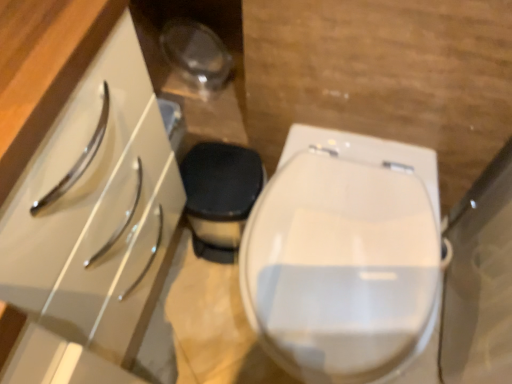
Identify the location of white glossy cabinet at left. (92, 226).

What do you see at coordinates (92, 226) in the screenshot? I see `white glossy cabinet at left` at bounding box center [92, 226].

The width and height of the screenshot is (512, 384). What do you see at coordinates (343, 256) in the screenshot? I see `white glossy toilet at center` at bounding box center [343, 256].

What is the approximate height of white glossy toilet at center?

white glossy toilet at center is 45.95 centimeters in height.

Locate an element on the screen. white glossy toilet at center is located at coordinates (343, 256).

At what (x,y) coordinates should I click in order to perform the action: click on white glossy cabinet at left. Please return your answer as a coordinate pair (x, y). The height and width of the screenshot is (384, 512). Looking at the image, I should click on (92, 226).

Does white glossy toilet at center appear on the right side of white glossy cabinet at left?

Yes, white glossy toilet at center is to the right of white glossy cabinet at left.

Is white glossy toilet at center in front of or behind white glossy cabinet at left in the image?

Visually, white glossy toilet at center is located behind white glossy cabinet at left.

Considering the positions of point (337, 155) and point (81, 286), is point (337, 155) closer or farther from the camera than point (81, 286)?

Point (337, 155) is positioned farther from the camera compared to point (81, 286).

From the picture: From the image's perspective, which one is positioned lower, white glossy toilet at center or white glossy cabinet at left?

white glossy toilet at center, from the image's perspective.

From a real-world perspective, is white glossy toilet at center over white glossy cabinet at left?

No, from a real-world perspective, white glossy toilet at center is not above white glossy cabinet at left.

Looking at this image, in terms of width, does white glossy toilet at center look wider or thinner when compared to white glossy cabinet at left?

In the image, white glossy toilet at center appears to be wider than white glossy cabinet at left.

Considering the relative sizes of white glossy toilet at center and white glossy cabinet at left in the image provided, is white glossy toilet at center taller than white glossy cabinet at left?

Incorrect, the height of white glossy toilet at center is not larger of that of white glossy cabinet at left.

Based on their sizes in the image, would you say white glossy toilet at center is bigger or smaller than white glossy cabinet at left?

Clearly, white glossy toilet at center is smaller in size than white glossy cabinet at left.

Is white glossy toilet at center inside the boundaries of white glossy cabinet at left, or outside?

white glossy toilet at center cannot be found inside white glossy cabinet at left.

Is white glossy toilet at center positioned far away from white glossy cabinet at left?

That's not correct — white glossy toilet at center is a little close to white glossy cabinet at left.

Is white glossy toilet at center turned away from white glossy cabinet at left?

No, white glossy toilet at center is not facing away from white glossy cabinet at left.

Locate an element on the screen. The image size is (512, 384). toilet that is below the white glossy cabinet at left (from the image's perspective) is located at coordinates (343, 256).

Between white glossy cabinet at left and white glossy toilet at center, which one appears on the left side from the viewer's perspective?

white glossy cabinet at left.

Which object is further away from the camera, white glossy cabinet at left or white glossy toilet at center?

white glossy toilet at center is further from the camera.

Which is in front, point (131, 293) or point (321, 359)?

The point (321, 359) is closer to the camera.

From the image's perspective, between white glossy cabinet at left and white glossy toilet at center, which one is located above?

white glossy cabinet at left is shown above in the image.

From a real-world perspective, is white glossy cabinet at left physically above white glossy toilet at center?

Yes, from a real-world perspective, white glossy cabinet at left is on top of white glossy toilet at center.

Considering the relative sizes of white glossy cabinet at left and white glossy toilet at center in the image provided, is white glossy cabinet at left wider than white glossy toilet at center?

No, white glossy cabinet at left is not wider than white glossy toilet at center.

Considering the relative sizes of white glossy cabinet at left and white glossy toilet at center in the image provided, is white glossy cabinet at left taller than white glossy toilet at center?

Yes, white glossy cabinet at left is taller than white glossy toilet at center.

In the scene shown: Is white glossy cabinet at left smaller than white glossy toilet at center?

No, white glossy cabinet at left is not smaller than white glossy toilet at center.

Can we say white glossy cabinet at left lies outside white glossy toilet at center?

Indeed, white glossy cabinet at left is completely outside white glossy toilet at center.

Does white glossy cabinet at left touch white glossy toilet at center?

No, white glossy cabinet at left is not touching white glossy toilet at center.

Is white glossy cabinet at left looking in the opposite direction of white glossy toilet at center?

No, white glossy cabinet at left's orientation is not away from white glossy toilet at center.

How different are the orientations of white glossy cabinet at left and white glossy toilet at center in degrees?

They differ by 89.8 degrees in their facing directions.

The image size is (512, 384). Find the location of `cabinetry on the left of white glossy toilet at center`. cabinetry on the left of white glossy toilet at center is located at coordinates [92, 226].

The width and height of the screenshot is (512, 384). In order to click on cabinetry on the left of white glossy toilet at center in this screenshot , I will do `click(92, 226)`.

This screenshot has width=512, height=384. I want to click on toilet behind the white glossy cabinet at left, so click(343, 256).